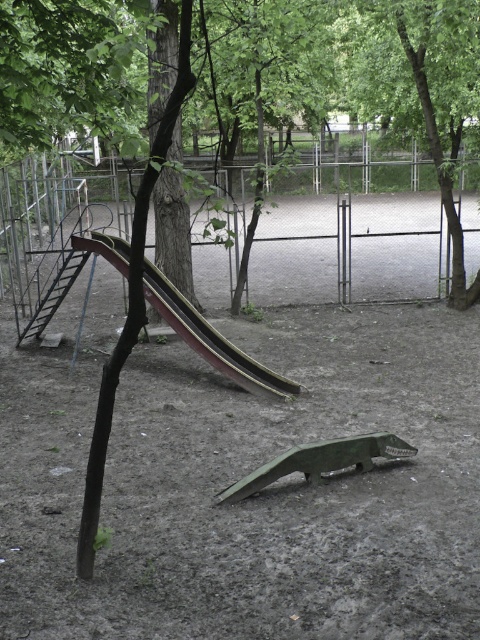
You are a child trying to climb the wooden smooth slide at left but notice the green leafy tree at center nearby. Is the tree blocking your path to the slide?

The green leafy tree at center is above the wooden smooth slide at left, so it is not blocking the path to the slide.

You are a parent trying to ensure your child stays within the playground area. The playground fence is 20 feet wide. If your child is playing near the green leafy tree at center and the wooden smooth slide at left, will they be within the fence?

The distance between the green leafy tree at center and the wooden smooth slide at left is 19.26 feet, which is less than the 20 feet width of the fence. Therefore, the child remains within the playground area.

You are a parent trying to decide where to place a new bench in the playground. The bench is 2 meters wide. You want to place it either next to the green leafy tree at center or near the wooden smooth slide at left. Based on their widths, which location has enough space for the bench?

The green leafy tree at center is wider than the wooden smooth slide at left. Therefore, placing the bench next to the green leafy tree at center would provide sufficient space since it is wider, while the wooden smooth slide at left might not have enough space due to its narrower width.